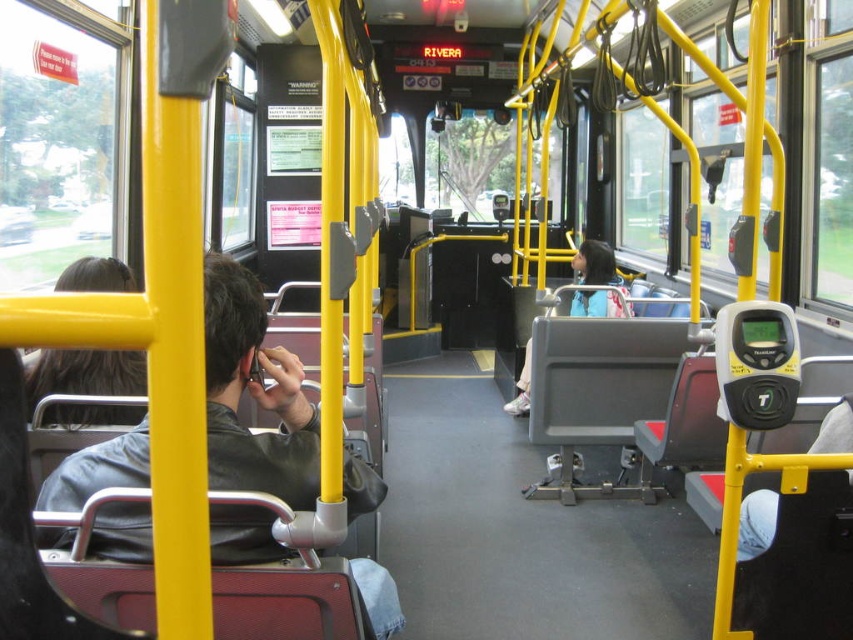
Question: Is dark brown hair at left thinner than light blue jacket at center?

Choices:
 (A) no
 (B) yes

Answer: (B)

Question: Which of the following is the closest to the observer?

Choices:
 (A) (59, 387)
 (B) (518, 378)

Answer: (A)

Question: Is dark brown hair at left bigger than light blue jacket at center?

Choices:
 (A) no
 (B) yes

Answer: (A)

Question: Which point is closer to the camera?

Choices:
 (A) (32, 371)
 (B) (590, 244)
 (C) (215, 518)

Answer: (C)

Question: Which point appears farthest from the camera in this image?

Choices:
 (A) (589, 248)
 (B) (352, 516)

Answer: (A)

Question: Is leather jacket at left thinner than light blue jacket at center?

Choices:
 (A) no
 (B) yes

Answer: (A)